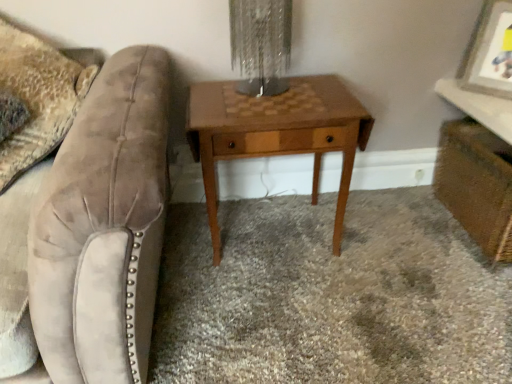
Locate an element on the screen. empty space that is to the right of woodenmaterial/texturenightstand at center is located at coordinates (392, 248).